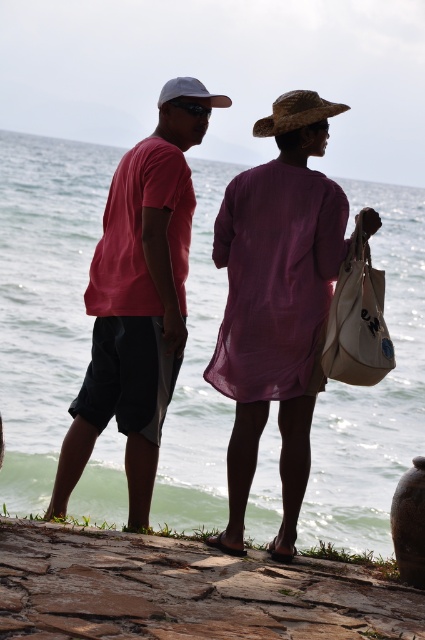
Which of these two, green water at center or matte purple dress at center, stands shorter?

Standing shorter between the two is matte purple dress at center.

Between green water at center and matte purple dress at center, which one appears on the left side from the viewer's perspective?

green water at center is more to the left.

Does point (74, 332) come closer to viewer compared to point (227, 269)?

No, (74, 332) is behind (227, 269).

The height and width of the screenshot is (640, 425). I want to click on green water at center, so click(45, 298).

Is green water at center wider than matte pink shirt at center?

Yes.

Between point (210, 241) and point (149, 336), which one is positioned in front?

Point (149, 336)

Between point (351, 200) and point (197, 138), which one is positioned behind?

Positioned behind is point (351, 200).

Image resolution: width=425 pixels, height=640 pixels. In order to click on green water at center in this screenshot , I will do click(x=45, y=298).

Who is taller, matte purple dress at center or matte pink shirt at center?

matte pink shirt at center

Is point (232, 461) farther from viewer compared to point (153, 282)?

No.

Locate an element on the screen. The height and width of the screenshot is (640, 425). matte purple dress at center is located at coordinates (277, 305).